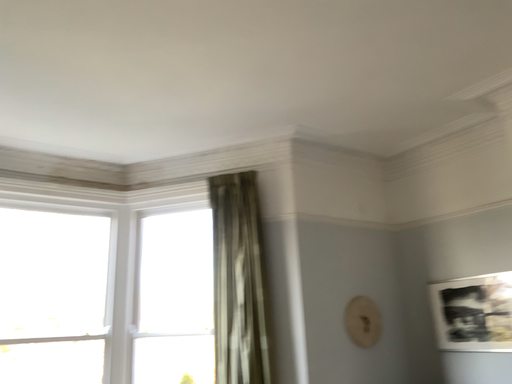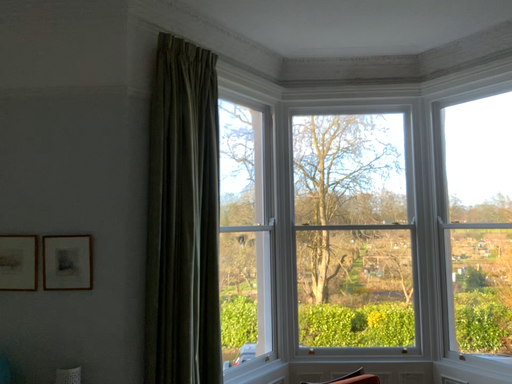
Question: How did the camera likely rotate when shooting the video?

Choices:
 (A) rotated downward
 (B) rotated upward

Answer: (A)